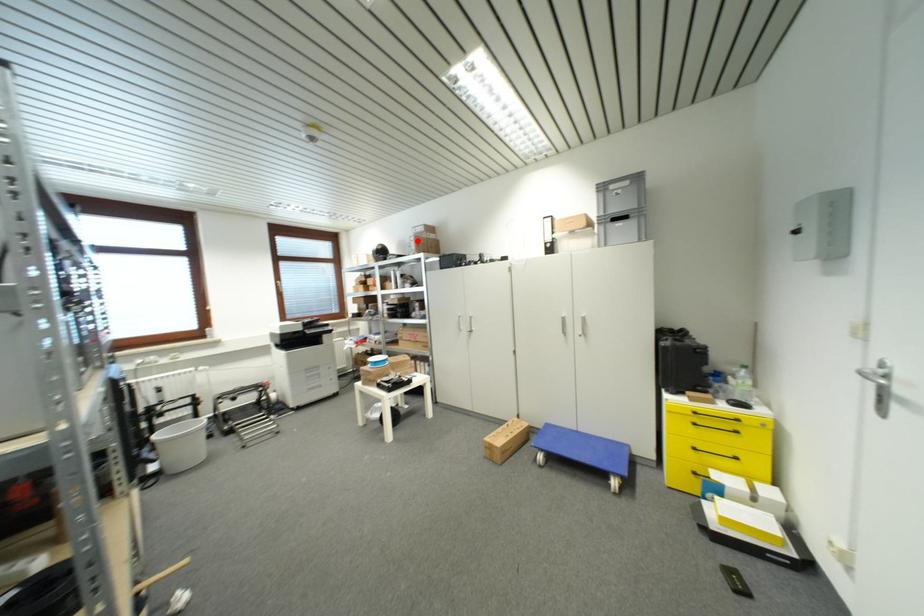
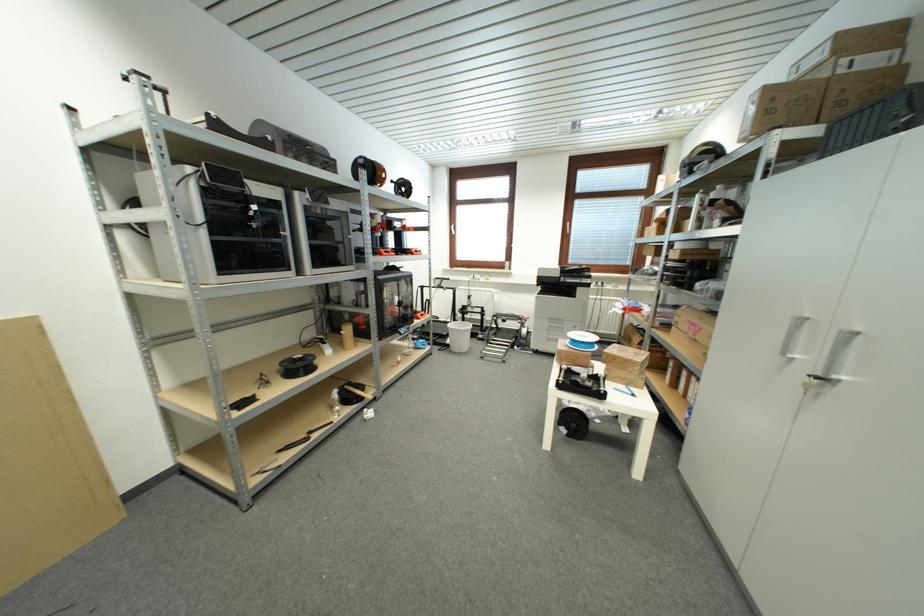
Question: A red point is marked in image1. In image2, is the corresponding 3D point closer to the camera or farther? Reply with the corresponding letter.

Choices:
 (A) The corresponding 3D point is closer.
 (B) The corresponding 3D point is farther.

Answer: (B)